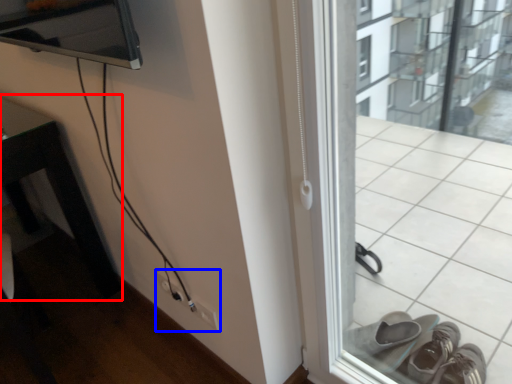
Question: Which of the following is the closest to the observer, table (highlighted by a red box) or electric outlet (highlighted by a blue box)?

Choices:
 (A) table
 (B) electric outlet

Answer: (A)